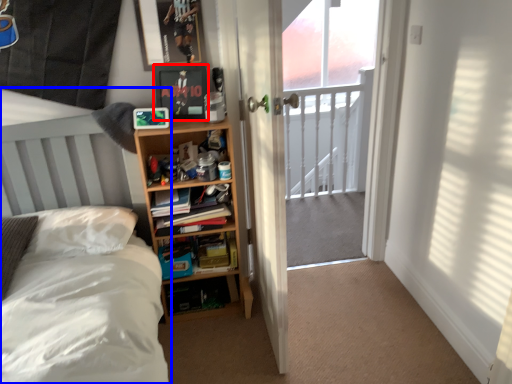
Question: Which of the following is the closest to the observer, picture frame (highlighted by a red box) or bed (highlighted by a blue box)?

Choices:
 (A) picture frame
 (B) bed

Answer: (B)